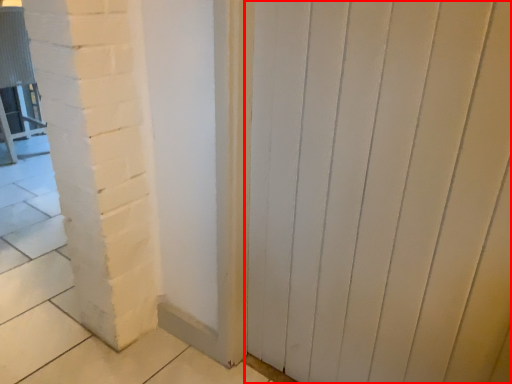
Question: From the image's perspective, where is door (annotated by the red box) located in relation to chair in the image?

Choices:
 (A) below
 (B) above

Answer: (A)